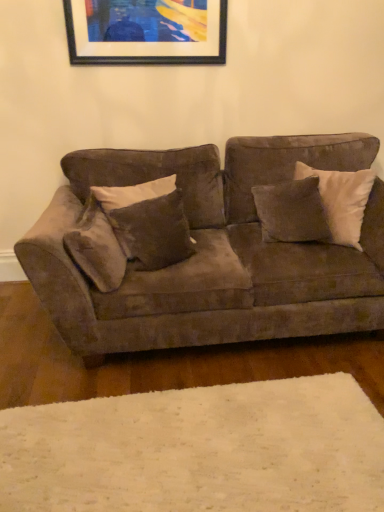
Question: Is white soft rug at lower center not close to suede-like brown pillow at left, positioned as the first pillow in left-to-right order?

Choices:
 (A) yes
 (B) no

Answer: (B)

Question: Is suede-like brown pillow at left, the third pillow in the right-to-left sequence, surrounded by white soft rug at lower center?

Choices:
 (A) no
 (B) yes

Answer: (A)

Question: Is the depth of white soft rug at lower center less than that of suede-like brown pillow at left, the third pillow in the right-to-left sequence?

Choices:
 (A) yes
 (B) no

Answer: (A)

Question: Can you confirm if white soft rug at lower center is wider than suede-like brown pillow at left, the third pillow in the right-to-left sequence?

Choices:
 (A) yes
 (B) no

Answer: (A)

Question: Are white soft rug at lower center and suede-like brown pillow at left, the third pillow in the right-to-left sequence, beside each other?

Choices:
 (A) no
 (B) yes

Answer: (A)

Question: Considering the positions of suede couch at center and black matte picture frame at upper center in the image, is suede couch at center bigger or smaller than black matte picture frame at upper center?

Choices:
 (A) small
 (B) big

Answer: (B)

Question: Looking at their shapes, would you say suede couch at center is wider or thinner than black matte picture frame at upper center?

Choices:
 (A) wide
 (B) thin

Answer: (A)

Question: Considering the positions of suede couch at center and black matte picture frame at upper center in the image, is suede couch at center taller or shorter than black matte picture frame at upper center?

Choices:
 (A) tall
 (B) short

Answer: (A)

Question: From the image's perspective, is suede couch at center located above or below black matte picture frame at upper center?

Choices:
 (A) below
 (B) above

Answer: (A)

Question: From a real-world perspective, relative to velvet brown pillow at center, positioned as the second pillow in right-to-left order, is suede couch at center vertically above or below?

Choices:
 (A) above
 (B) below

Answer: (B)

Question: In the image, is suede couch at center positioned in front of or behind velvet brown pillow at center, which is the 2th pillow in left-to-right order?

Choices:
 (A) behind
 (B) front

Answer: (B)

Question: Is point (150, 314) closer or farther from the camera than point (155, 243)?

Choices:
 (A) closer
 (B) farther

Answer: (A)

Question: From the image's perspective, is suede couch at center above or below velvet brown pillow at center, positioned as the second pillow in right-to-left order?

Choices:
 (A) above
 (B) below

Answer: (B)

Question: In terms of height, does velvet brown pillow at center, which is the 2th pillow in left-to-right order, look taller or shorter compared to suede couch at center?

Choices:
 (A) tall
 (B) short

Answer: (B)

Question: From a real-world perspective, is velvet brown pillow at center, which is the 2th pillow in left-to-right order, above or below suede couch at center?

Choices:
 (A) below
 (B) above

Answer: (B)